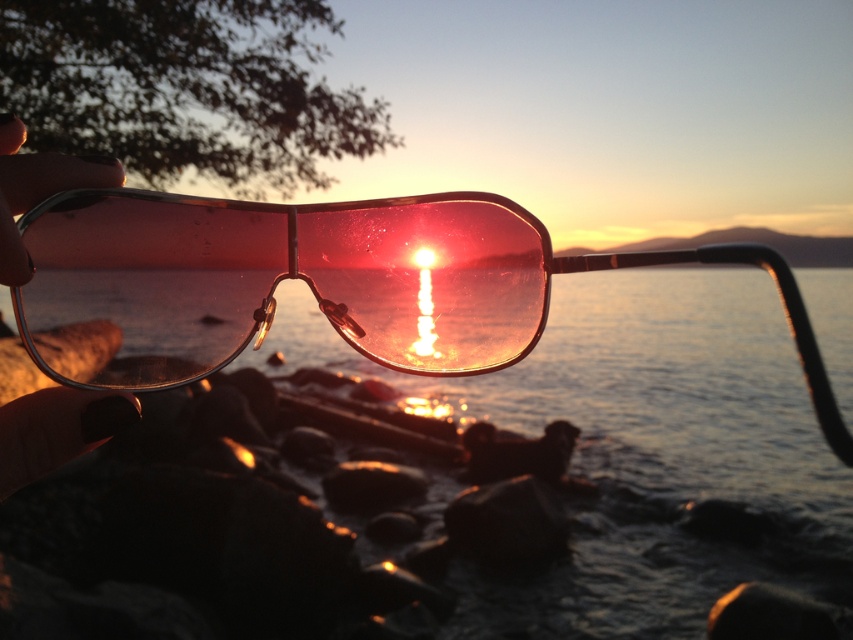
You are standing at the edge of the water and want to place a small floating toy at point (643, 388). According to the scene description, what will the toy be floating on?

The toy will be floating on the translucent water at center located at point (643, 388).

You are trying to see the sunset through the transparent plastic goggles at center. Can you see the translucent water at center through them?

The translucent water at center is in front of the transparent plastic goggles at center, so you can see the translucent water at center through the transparent plastic goggles at center.